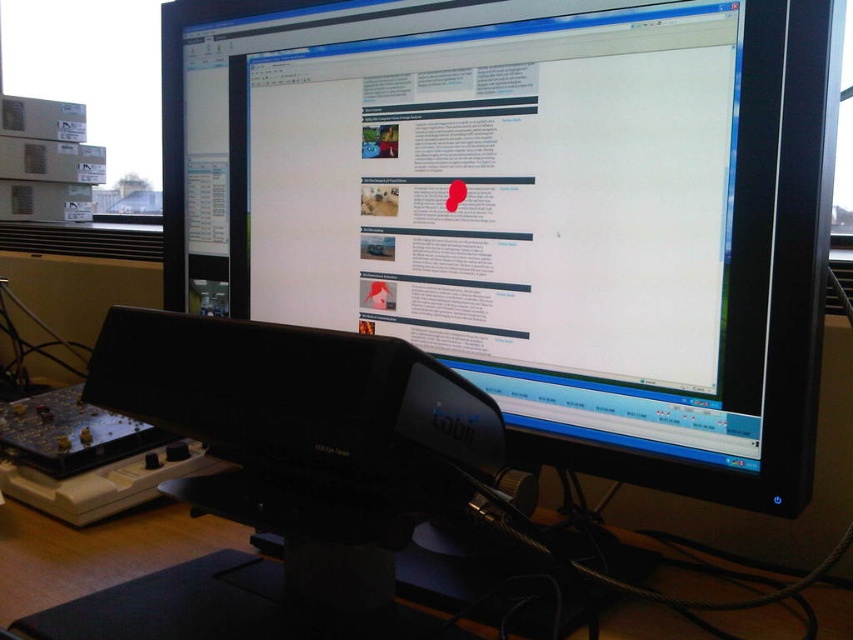
Question: Among these points, which one is nearest to the camera?

Choices:
 (A) (489, 444)
 (B) (445, 1)

Answer: (A)

Question: Is matte black monitor at center closer to the viewer compared to black plastic tobii eye tracker at lower center?

Choices:
 (A) yes
 (B) no

Answer: (B)

Question: Does matte black monitor at center appear under black plastic tobii eye tracker at lower center?

Choices:
 (A) yes
 (B) no

Answer: (B)

Question: Is matte black monitor at center below black plastic tobii eye tracker at lower center?

Choices:
 (A) no
 (B) yes

Answer: (A)

Question: Which of the following is the farthest from the observer?

Choices:
 (A) (173, 20)
 (B) (384, 545)

Answer: (A)